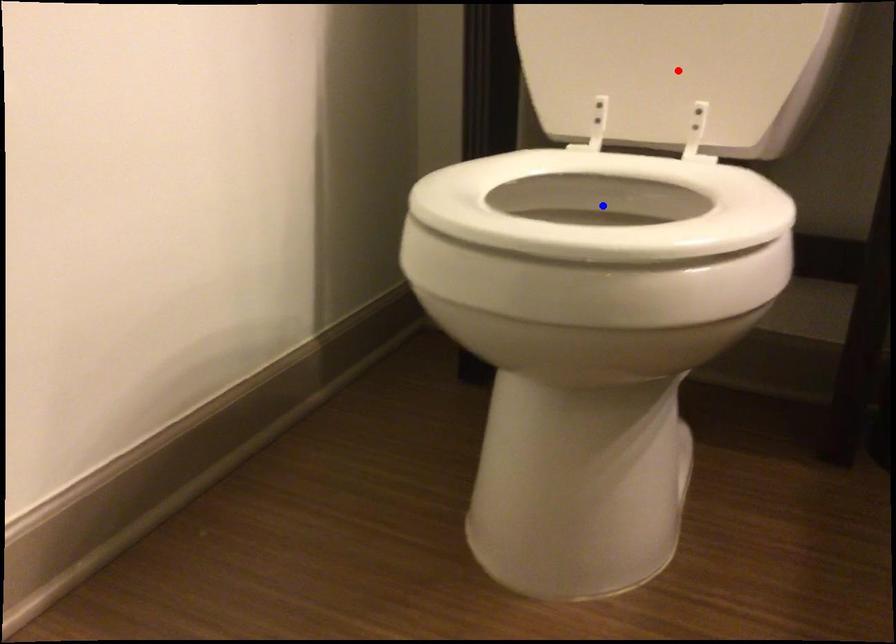
Question: Which of the two points in the image is closer to the camera?

Choices:
 (A) Blue point is closer.
 (B) Red point is closer.

Answer: (A)